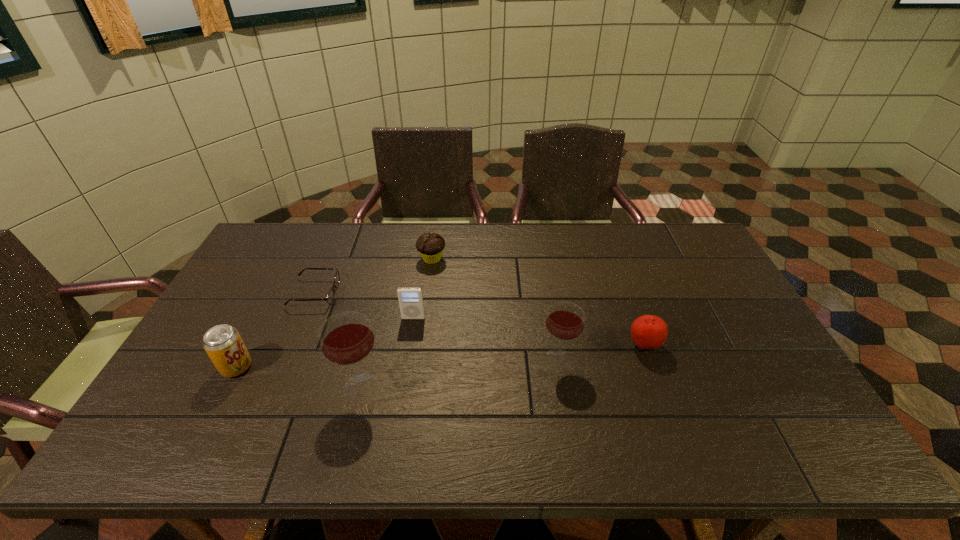
This screenshot has width=960, height=540. Find the location of `vacant area that satisfies the following two spatial constraints: 1. on the lenses of the spectacles; 2. on the right side of the apple`. vacant area that satisfies the following two spatial constraints: 1. on the lenses of the spectacles; 2. on the right side of the apple is located at coordinates pos(293,345).

Locate an element on the screen. The width and height of the screenshot is (960, 540). vacant space that satisfies the following two spatial constraints: 1. on the lenses of the sixth shortest object; 2. on the left side of the second object from left to right is located at coordinates (287, 359).